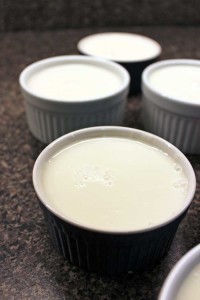
The image size is (200, 300). In order to click on empty space to left of ramikin in this screenshot , I will do pyautogui.click(x=39, y=39).